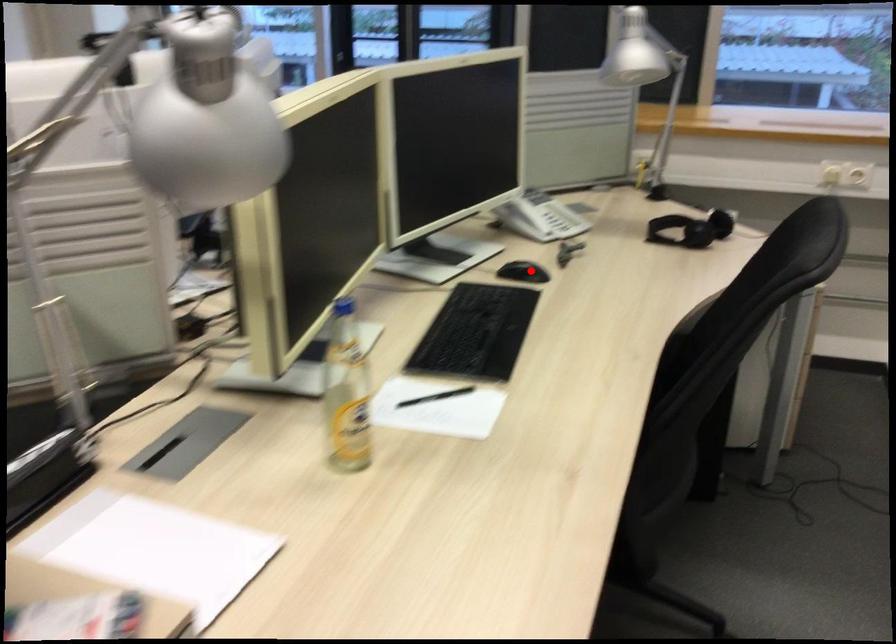
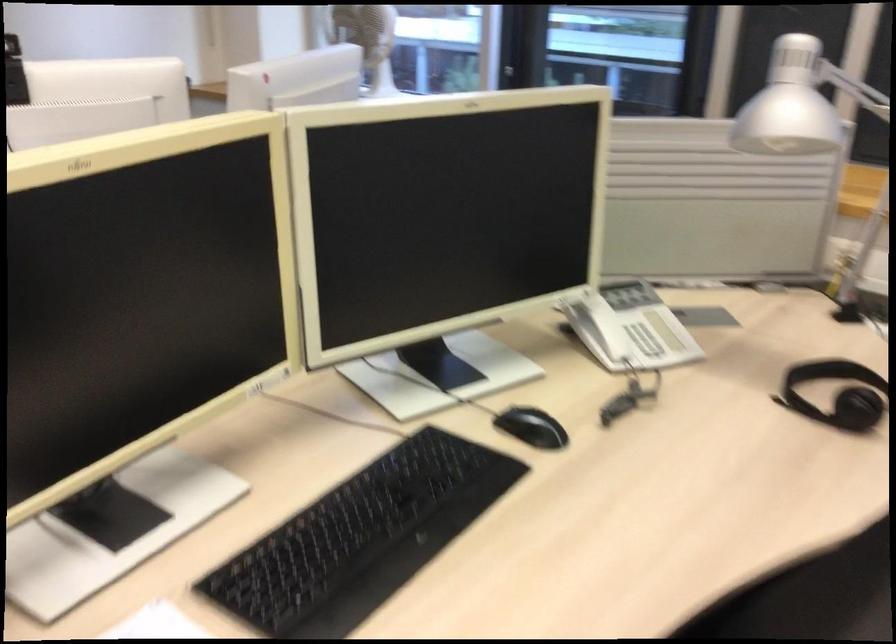
Question: I am providing you with two images of the same scene from different viewpoints. Given a red point in image1, look at the same physical point in image2. Is it:

Choices:
 (A) Closer to the viewpoint
 (B) Farther from the viewpoint

Answer: (A)